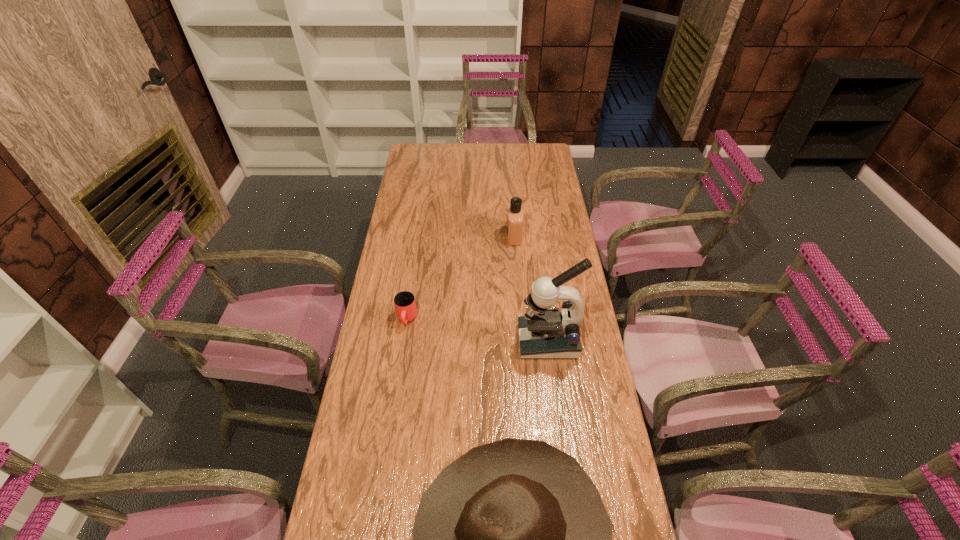
Identify the location of object that is positioned at the right edge. (544, 333).

I want to click on free space at the far edge of the desktop, so click(502, 151).

Identify the location of free space at the left edge of the desktop. (429, 199).

This screenshot has height=540, width=960. In order to click on vacant space at the right edge in this screenshot , I will do click(568, 453).

What are the coordinates of `vacant space in between the perfume and the cup` in the screenshot? It's located at (460, 277).

This screenshot has height=540, width=960. What are the coordinates of `blank region between the microscope and the cup` in the screenshot? It's located at (477, 330).

Locate an element on the screen. unoccupied area between the cup and the perfume is located at coordinates (460, 277).

Find the location of a particular element. the third closest object to the microscope is located at coordinates (514, 219).

Image resolution: width=960 pixels, height=540 pixels. Identify the location of object that is the second closest one to the tallest object. (405, 306).

This screenshot has width=960, height=540. In order to click on free space that satisfies the following two spatial constraints: 1. on the front label of the farthest object; 2. on the right side of the microscope in this screenshot , I will do `click(522, 341)`.